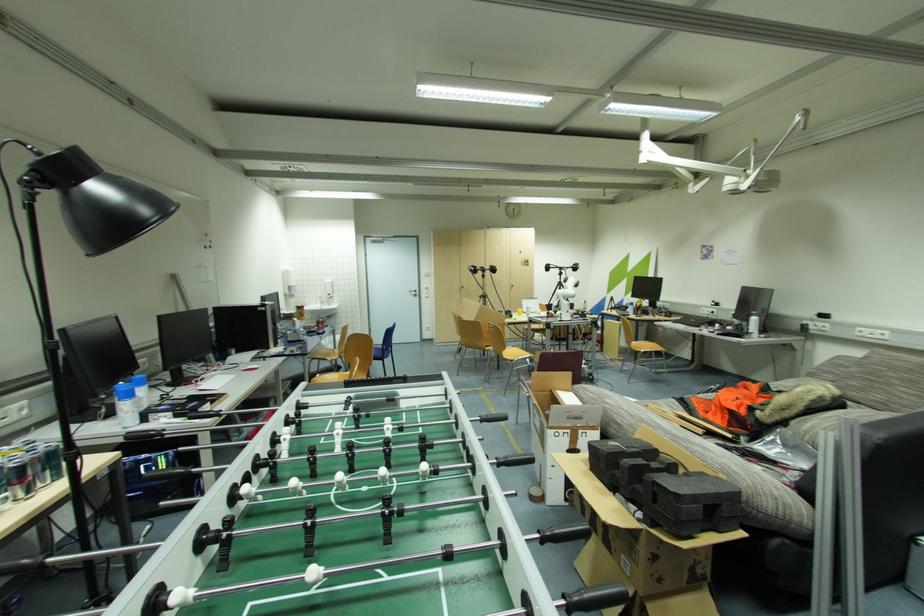
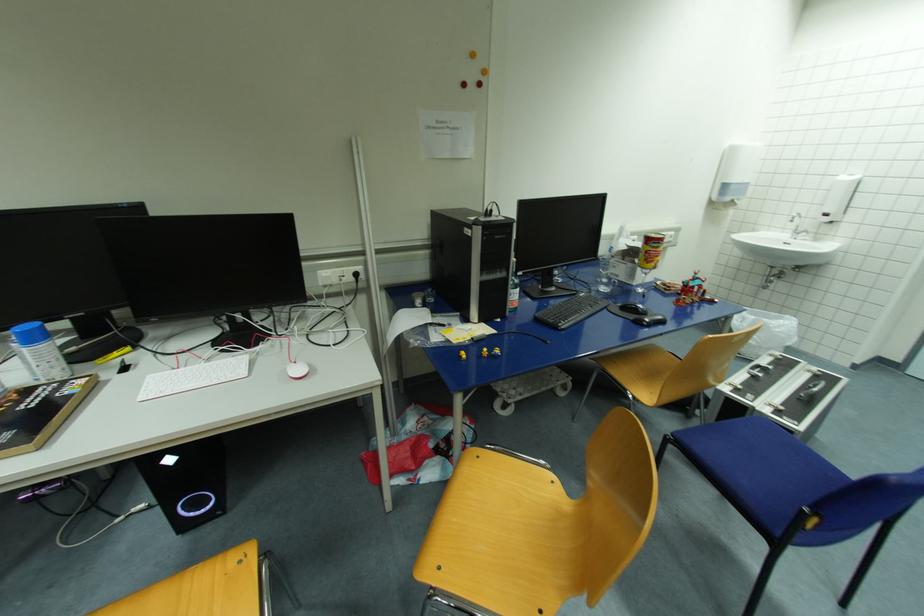
Where in the second image is the point corresponding to point (304, 309) from the first image?

(653, 241)